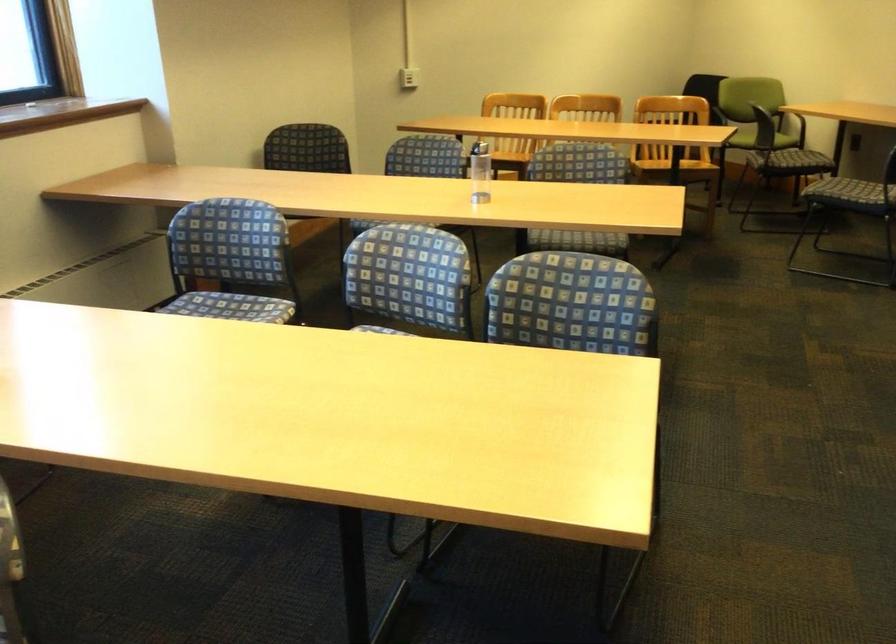
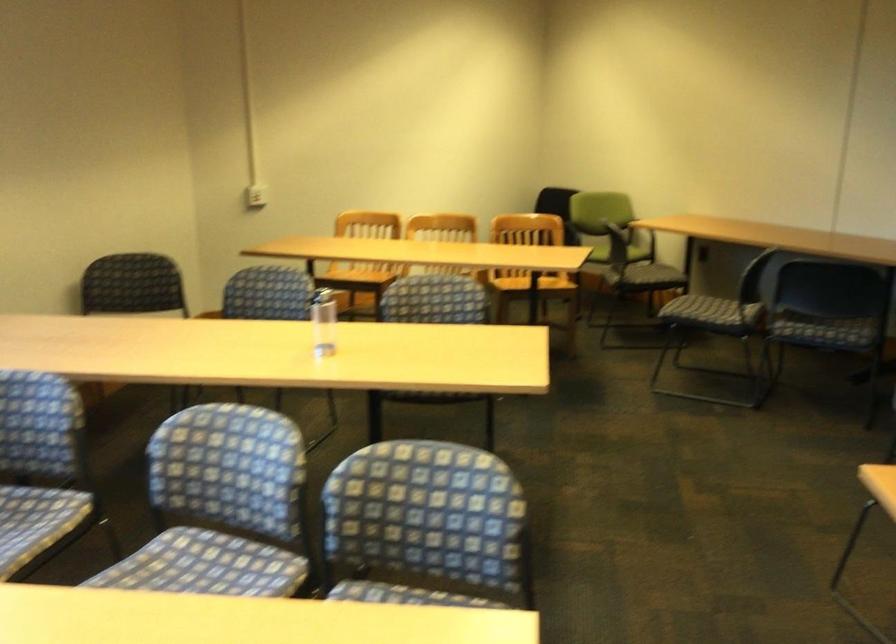
In the second image, find the point that corresponds to point (788, 152) in the first image.

(643, 277)